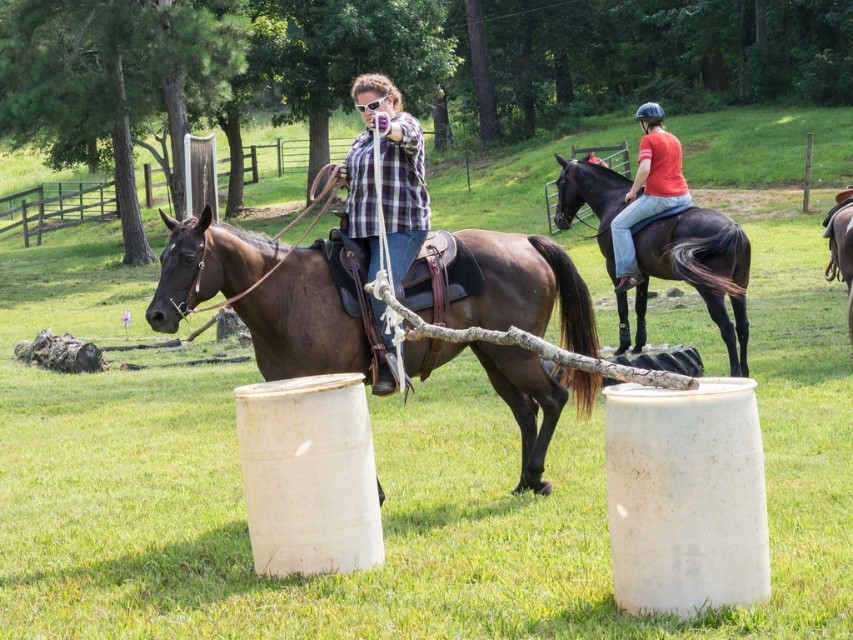
Looking at this image, does brown leather horse at center have a lesser width compared to brown leather horse at right?

In fact, brown leather horse at center might be wider than brown leather horse at right.

Which is more to the left, brown leather horse at center or brown leather horse at right?

From the viewer's perspective, brown leather horse at center appears more on the left side.

Between point (527, 236) and point (849, 228), which one is positioned behind?

Point (849, 228)

Find the location of a particular element. brown leather horse at center is located at coordinates (302, 321).

Which of these two, brown leather horse at center or red cotton shirt at upper right, stands taller?

Standing taller between the two is red cotton shirt at upper right.

From the picture: Does brown leather horse at center have a lesser height compared to red cotton shirt at upper right?

Correct, brown leather horse at center is not as tall as red cotton shirt at upper right.

Which is behind, point (277, 340) or point (656, 192)?

Positioned behind is point (656, 192).

The height and width of the screenshot is (640, 853). Find the location of `brown leather horse at center`. brown leather horse at center is located at coordinates (302, 321).

Does brown leather horse at center appear on the left side of shiny black horse at upper right?

Indeed, brown leather horse at center is positioned on the left side of shiny black horse at upper right.

Between point (167, 289) and point (727, 352), which one is positioned in front?

Positioned in front is point (167, 289).

The height and width of the screenshot is (640, 853). What are the coordinates of `brown leather horse at center` in the screenshot? It's located at (302, 321).